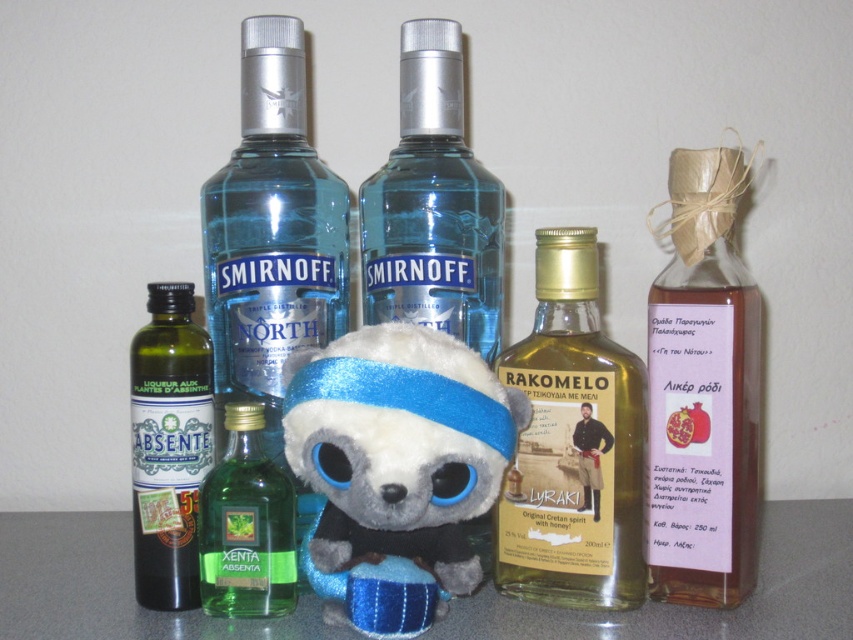
Question: Among these objects, which one is farthest from the camera?

Choices:
 (A) translucent amber bottle at center
 (B) transparent glass smirnoff north vodka at center

Answer: (B)

Question: Is fluffy plush toy at center below translucent amber bottle at center?

Choices:
 (A) no
 (B) yes

Answer: (B)

Question: Is fluffy plush toy at center above transparent glass smirnoff north vodka at center?

Choices:
 (A) no
 (B) yes

Answer: (A)

Question: Where is translucent amber bottle at center located in relation to green glass bottle at left in the image?

Choices:
 (A) above
 (B) below

Answer: (A)

Question: Which point is farther from the camera taking this photo?

Choices:
 (A) (546, 243)
 (B) (445, 573)

Answer: (A)

Question: Which is nearer to the translucent amber bottle at center?

Choices:
 (A) transparent glass smirnoff north vodka at center
 (B) translucent paper wrapped bottle at right

Answer: (B)